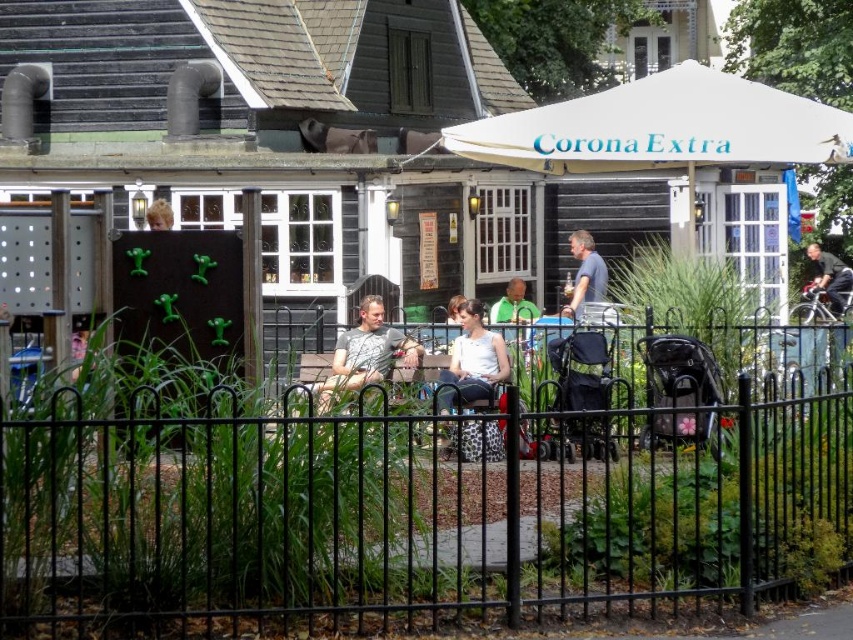
From the picture: You are a visitor standing in front of the black metal fence at center and the white matte tank top at center. Which object is positioned to the right side?

The black metal fence at center is positioned to the right of the white matte tank top at center.